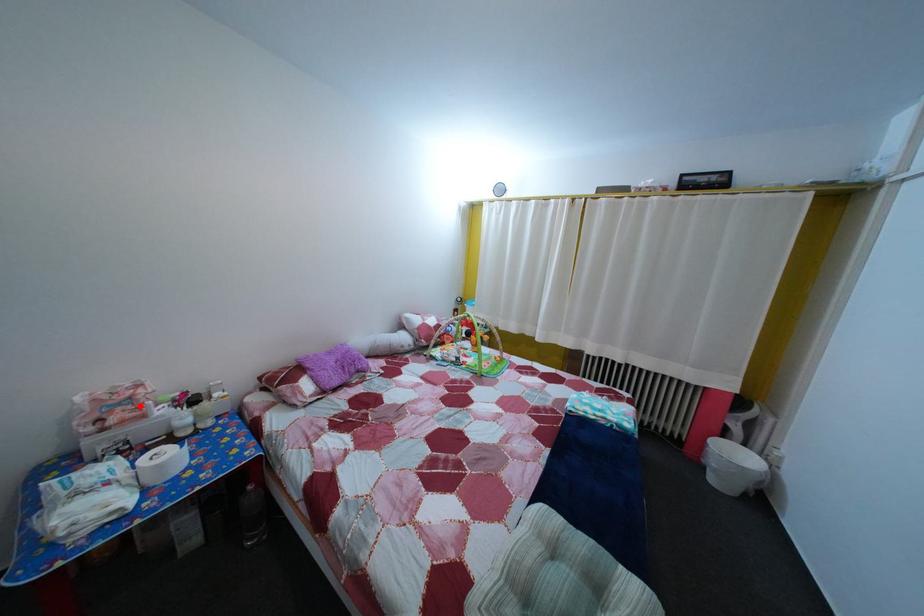
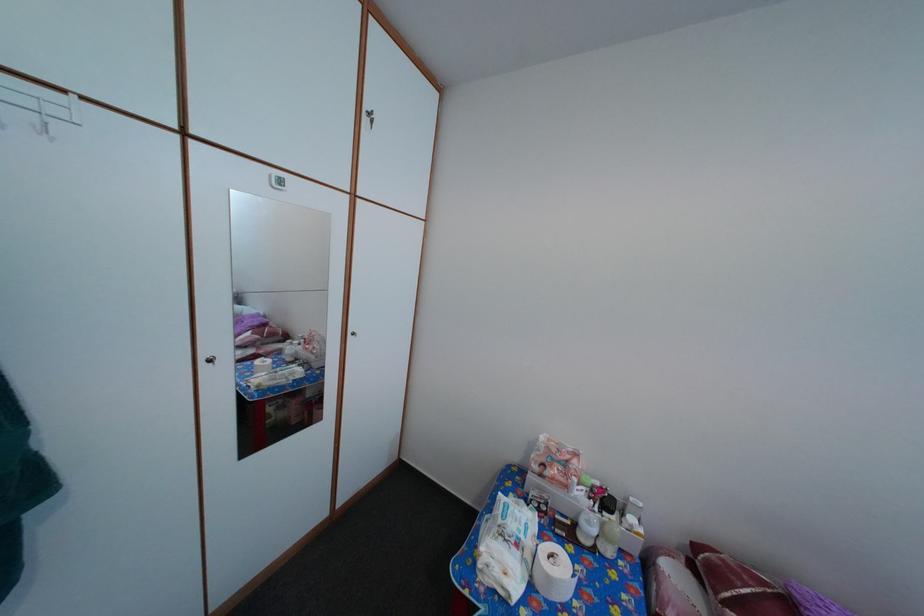
In the second image, find the point that corresponds to the highlighted location in the first image.

(576, 469)